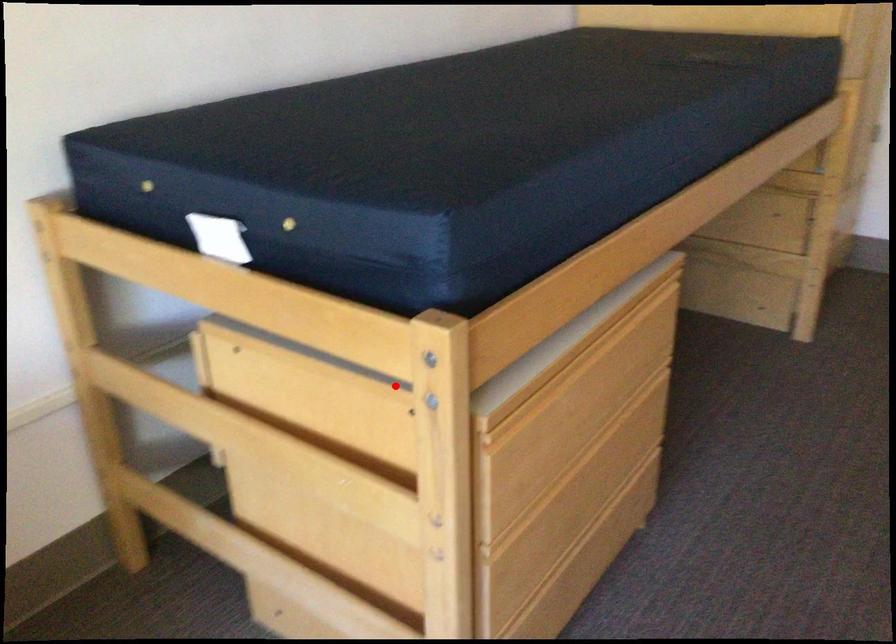
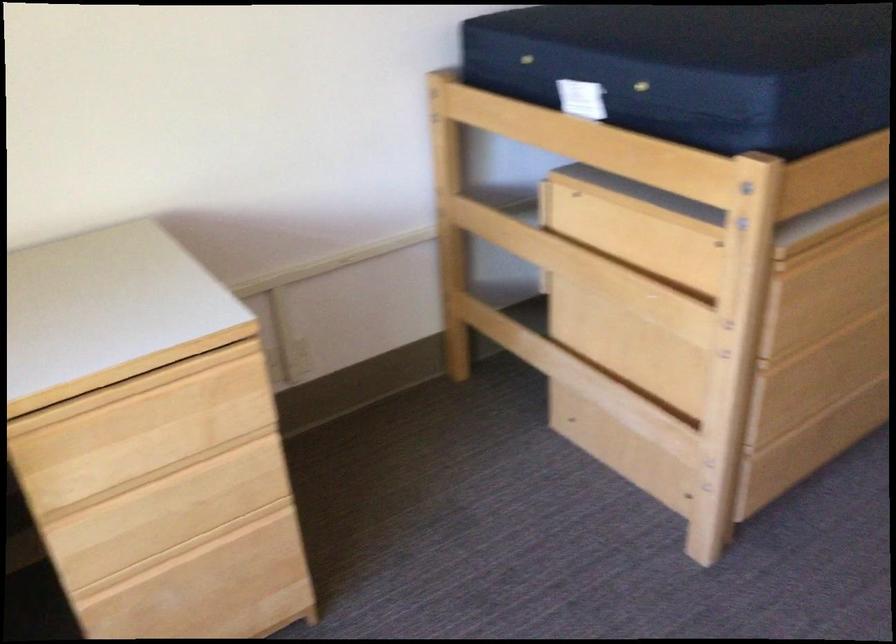
Where in the second image is the point corresponding to the highlighted location from the first image?

(703, 221)